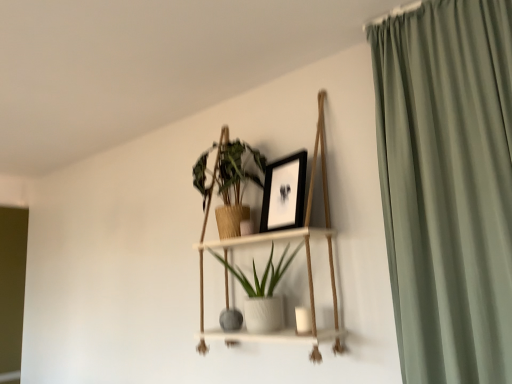
Measure the distance between black matte picture frame at upper center and camera.

A distance of 1.82 meters exists between black matte picture frame at upper center and camera.

What do you see at coordinates (284, 193) in the screenshot? I see `black matte picture frame at upper center` at bounding box center [284, 193].

From the picture: Measure the distance between point (237, 312) and camera.

A distance of 6.71 feet exists between point (237, 312) and camera.

I want to click on white wood shelf at center, so click(285, 239).

What do you see at coordinates (263, 274) in the screenshot?
I see `white textured pot at center, placed as the 1th houseplant when sorted from bottom to top` at bounding box center [263, 274].

I want to click on black matte picture frame at upper center, so click(284, 193).

Is green matte plant at upper center, the second houseplant ordered from the bottom, turned away from matte gray vase at center?

green matte plant at upper center, the second houseplant ordered from the bottom, does not have its back to matte gray vase at center.

Considering the sizes of green matte plant at upper center, which appears as the 1th houseplant when viewed from the top, and matte gray vase at center in the image, is green matte plant at upper center, which appears as the 1th houseplant when viewed from the top, wider or thinner than matte gray vase at center?

Clearly, green matte plant at upper center, which appears as the 1th houseplant when viewed from the top, has more width compared to matte gray vase at center.

Measure the distance from green matte plant at upper center, which appears as the 1th houseplant when viewed from the top, to matte gray vase at center.

green matte plant at upper center, which appears as the 1th houseplant when viewed from the top, is 60.32 centimeters from matte gray vase at center.

Which is correct: green matte plant at upper center, which appears as the 1th houseplant when viewed from the top, is inside matte gray vase at center, or outside of it?

green matte plant at upper center, which appears as the 1th houseplant when viewed from the top, is not inside matte gray vase at center, it's outside.

Which point is more forward, (x=234, y=322) or (x=203, y=175)?

Point (x=234, y=322)

Looking at their sizes, would you say matte gray vase at center is wider or thinner than green matte plant at upper center, the second houseplant ordered from the bottom?

Considering their sizes, matte gray vase at center looks slimmer than green matte plant at upper center, the second houseplant ordered from the bottom.

You are a GUI agent. You are given a task and a screenshot of the screen. Output one action in this format:
    pyautogui.click(x=<x>, y=<y>)
    Task: Click on the vase behind the green matte plant at upper center, the second houseplant ordered from the bottom
    This screenshot has width=512, height=384.
    Given the screenshot: What is the action you would take?
    (231, 319)

Is matte gray vase at center completely or partially outside of black matte picture frame at upper center?

matte gray vase at center is positioned outside black matte picture frame at upper center.

Based on the photo, what's the angular difference between matte gray vase at center and black matte picture frame at upper center's facing directions?

The angular difference between matte gray vase at center and black matte picture frame at upper center is 15 degrees.

Looking at their sizes, would you say matte gray vase at center is wider or thinner than black matte picture frame at upper center?

Clearly, matte gray vase at center has more width compared to black matte picture frame at upper center.

Is point (227, 319) closer or farther from the camera than point (294, 160)?

Point (227, 319).

I want to click on cabinet lying in front of the green matte plant at upper center, the second houseplant ordered from the bottom, so [285, 239].

Based on the photo, who is smaller, white wood shelf at center or green matte plant at upper center, the second houseplant ordered from the bottom?

green matte plant at upper center, the second houseplant ordered from the bottom.

Considering the points (243, 341) and (237, 214), which point is in front, point (243, 341) or point (237, 214)?

The point (243, 341) is closer.

Is white wood shelf at center touching green matte plant at upper center, which appears as the 1th houseplant when viewed from the top?

No.

Based on their sizes in the image, would you say black matte picture frame at upper center is bigger or smaller than white textured pot at center, placed as the 1th houseplant when sorted from bottom to top?

Clearly, black matte picture frame at upper center is smaller in size than white textured pot at center, placed as the 1th houseplant when sorted from bottom to top.

Which is behind, black matte picture frame at upper center or white textured pot at center, acting as the second houseplant starting from the top?

black matte picture frame at upper center is further away from the camera.

Is black matte picture frame at upper center facing away from white textured pot at center, acting as the second houseplant starting from the top?

No, white textured pot at center, acting as the second houseplant starting from the top, is not at the back of black matte picture frame at upper center.

From a real-world perspective, is black matte picture frame at upper center positioned under white textured pot at center, placed as the 1th houseplant when sorted from bottom to top, based on gravity?

No.

Is point (238, 220) closer to camera compared to point (282, 179)?

No, it is not.

From the image's perspective, between green matte plant at upper center, the second houseplant ordered from the bottom, and black matte picture frame at upper center, who is located below?

black matte picture frame at upper center is shown below in the image.

From a real-world perspective, who is located higher, green matte plant at upper center, the second houseplant ordered from the bottom, or black matte picture frame at upper center?

green matte plant at upper center, the second houseplant ordered from the bottom, is physically above.

Which is nearer, (273,273) or (302,206)?

Point (273,273) appears to be farther away from the viewer than point (302,206).

From the image's perspective, does white textured pot at center, placed as the 1th houseplant when sorted from bottom to top, appear lower than black matte picture frame at upper center?

Yes, from the image's perspective, white textured pot at center, placed as the 1th houseplant when sorted from bottom to top, is beneath black matte picture frame at upper center.

Measure the distance from white textured pot at center, acting as the second houseplant starting from the top, to black matte picture frame at upper center.

white textured pot at center, acting as the second houseplant starting from the top, and black matte picture frame at upper center are 11.50 inches apart from each other.

From the picture: Can you confirm if white textured pot at center, acting as the second houseplant starting from the top, is bigger than black matte picture frame at upper center?

Yes.

The width and height of the screenshot is (512, 384). Find the location of `vase below the green matte plant at upper center, which appears as the 1th houseplant when viewed from the top (from a real-world perspective)`. vase below the green matte plant at upper center, which appears as the 1th houseplant when viewed from the top (from a real-world perspective) is located at coordinates (231, 319).

From the image's perspective, which houseplant is the 2nd one above the matte gray vase at center? Please provide its 2D coordinates.

[(228, 183)]

When comparing their distances from green matte plant at upper center, the second houseplant ordered from the bottom, does black matte picture frame at upper center or white wood shelf at center seem closer?

Among the two, black matte picture frame at upper center is located nearer to green matte plant at upper center, the second houseplant ordered from the bottom.

When comparing their distances from black matte picture frame at upper center, does matte gray vase at center or white textured pot at center, placed as the 1th houseplant when sorted from bottom to top, seem further?

Among the two, matte gray vase at center is located further to black matte picture frame at upper center.

Based on their spatial positions, is white wood shelf at center or green matte plant at upper center, which appears as the 1th houseplant when viewed from the top, further from black matte picture frame at upper center?

green matte plant at upper center, which appears as the 1th houseplant when viewed from the top.

From the image, which object appears to be nearer to white wood shelf at center, black matte picture frame at upper center or green matte plant at upper center, the second houseplant ordered from the bottom?

black matte picture frame at upper center is positioned closer to the anchor white wood shelf at center.

Which object lies further to the anchor point green matte plant at upper center, the second houseplant ordered from the bottom, white textured pot at center, placed as the 1th houseplant when sorted from bottom to top, or matte gray vase at center?

The object further to green matte plant at upper center, the second houseplant ordered from the bottom, is matte gray vase at center.

From the image, which object appears to be nearer to black matte picture frame at upper center, white wood shelf at center or matte gray vase at center?

white wood shelf at center is closer to black matte picture frame at upper center.

From the image, which object appears to be nearer to matte gray vase at center, white textured pot at center, acting as the second houseplant starting from the top, or green matte plant at upper center, which appears as the 1th houseplant when viewed from the top?

white textured pot at center, acting as the second houseplant starting from the top, is closer to matte gray vase at center.

From the image, which object appears to be nearer to green matte plant at upper center, the second houseplant ordered from the bottom, white wood shelf at center or matte gray vase at center?

white wood shelf at center.

This screenshot has width=512, height=384. I want to click on houseplant between green matte plant at upper center, the second houseplant ordered from the bottom, and matte gray vase at center, in the vertical direction, so click(x=263, y=274).

Locate an element on the screen. The image size is (512, 384). cabinet situated between green matte plant at upper center, which appears as the 1th houseplant when viewed from the top, and black matte picture frame at upper center from left to right is located at coordinates (285, 239).

I want to click on picture frame between green matte plant at upper center, which appears as the 1th houseplant when viewed from the top, and matte gray vase at center vertically, so click(284, 193).

Where is `cabinet between black matte picture frame at upper center and matte gray vase at center from top to bottom`? This screenshot has width=512, height=384. cabinet between black matte picture frame at upper center and matte gray vase at center from top to bottom is located at coordinates (285, 239).